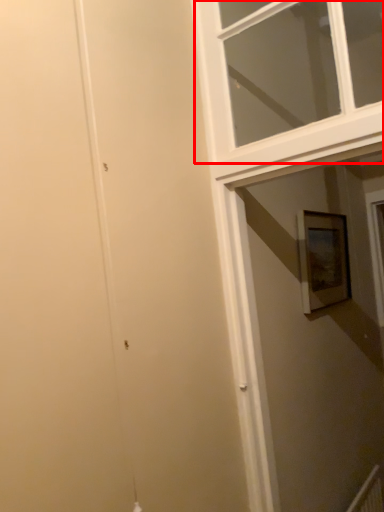
Question: Considering the relative positions of window (annotated by the red box) and picture frame in the image provided, where is window (annotated by the red box) located with respect to the staircase?

Choices:
 (A) left
 (B) right

Answer: (A)